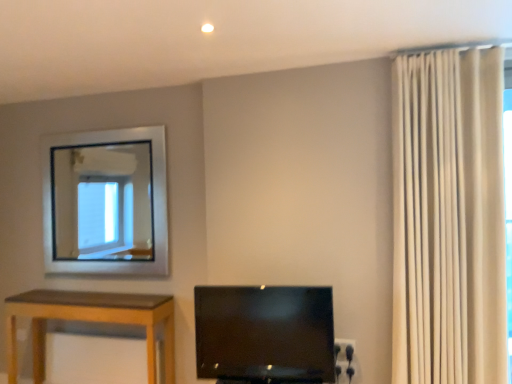
What do you see at coordinates (448, 218) in the screenshot?
I see `white textured curtain at right` at bounding box center [448, 218].

Measure the distance between point [425,156] and camera.

The distance of point [425,156] from camera is 7.89 feet.

Locate an element on the screen. white textured curtain at right is located at coordinates (448, 218).

Image resolution: width=512 pixels, height=384 pixels. Describe the element at coordinates (264, 334) in the screenshot. I see `matte black tv at center` at that location.

What is the approximate width of matte black tv at center?

matte black tv at center is 4.82 inches wide.

Where is `matte black tv at center`? The height and width of the screenshot is (384, 512). matte black tv at center is located at coordinates [x=264, y=334].

Where is `white textured curtain at right`? This screenshot has height=384, width=512. white textured curtain at right is located at coordinates (448, 218).

Based on their positions, is white textured curtain at right located to the left or right of matte black tv at center?

white textured curtain at right is positioned on matte black tv at center's right side.

Considering their positions, is white textured curtain at right located in front of or behind matte black tv at center?

white textured curtain at right is positioned closer to the viewer than matte black tv at center.

Which is closer to the camera, (504,355) or (258,343)?

The point (504,355) is more forward.

From the image's perspective, is white textured curtain at right beneath matte black tv at center?

No, from the image's perspective, white textured curtain at right is not below matte black tv at center.

From a real-world perspective, which is physically above, white textured curtain at right or matte black tv at center?

In real-world perspective, white textured curtain at right is above.

Considering the relative sizes of white textured curtain at right and matte black tv at center in the image provided, is white textured curtain at right wider than matte black tv at center?

Yes, white textured curtain at right is wider than matte black tv at center.

Considering the sizes of objects white textured curtain at right and matte black tv at center in the image provided, who is taller, white textured curtain at right or matte black tv at center?

white textured curtain at right.

Considering the sizes of objects white textured curtain at right and matte black tv at center in the image provided, who is smaller, white textured curtain at right or matte black tv at center?

matte black tv at center is smaller.

Is white textured curtain at right positioned beyond the bounds of matte black tv at center?

That's correct, white textured curtain at right is outside of matte black tv at center.

Would you consider white textured curtain at right to be distant from matte black tv at center?

That's not correct — white textured curtain at right is a little close to matte black tv at center.

Is white textured curtain at right turned away from matte black tv at center?

white textured curtain at right is not turned away from matte black tv at center.

How many degrees apart are the facing directions of white textured curtain at right and matte black tv at center?

white textured curtain at right and matte black tv at center are facing 5.59 degrees away from each other.

I want to click on television located behind the white textured curtain at right, so click(264, 334).

Consider the image. Visually, is matte black tv at center positioned to the left or to the right of white textured curtain at right?

matte black tv at center is to the left of white textured curtain at right.

Between matte black tv at center and white textured curtain at right, which one is positioned behind?

matte black tv at center is behind.

Considering the points (252, 297) and (409, 317), which point is behind, point (252, 297) or point (409, 317)?

The point (409, 317) is farther.

From the image's perspective, is matte black tv at center above or below white textured curtain at right?

Based on their image positions, matte black tv at center is located beneath white textured curtain at right.

From a real-world perspective, does matte black tv at center stand above white textured curtain at right?

No, from a real-world perspective, matte black tv at center is not over white textured curtain at right

Is matte black tv at center wider than white textured curtain at right?

No, matte black tv at center is not wider than white textured curtain at right.

Which of these two, matte black tv at center or white textured curtain at right, stands shorter?

matte black tv at center is shorter.

Is matte black tv at center bigger than white textured curtain at right?

No.

Can we say matte black tv at center lies outside white textured curtain at right?

Yes, matte black tv at center is outside of white textured curtain at right.

Are matte black tv at center and white textured curtain at right located far from each other?

They are positioned close to each other.

Could you tell me if matte black tv at center is facing white textured curtain at right?

No, matte black tv at center is not turned towards white textured curtain at right.

This screenshot has height=384, width=512. What are the coordinates of `television behind the white textured curtain at right` in the screenshot? It's located at 264,334.

Find the location of `curtain above the matte black tv at center (from a real-world perspective)`. curtain above the matte black tv at center (from a real-world perspective) is located at coordinates (448, 218).

At what (x,y) coordinates should I click in order to perform the action: click on curtain in front of the matte black tv at center. Please return your answer as a coordinate pair (x, y). The width and height of the screenshot is (512, 384). Looking at the image, I should click on (448, 218).